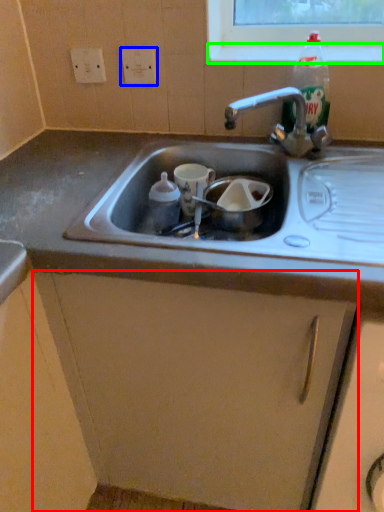
Question: Which is farther away from cabinetry (highlighted by a red box)? electric outlet (highlighted by a blue box) or window sill (highlighted by a green box)?

Choices:
 (A) electric outlet
 (B) window sill

Answer: (A)